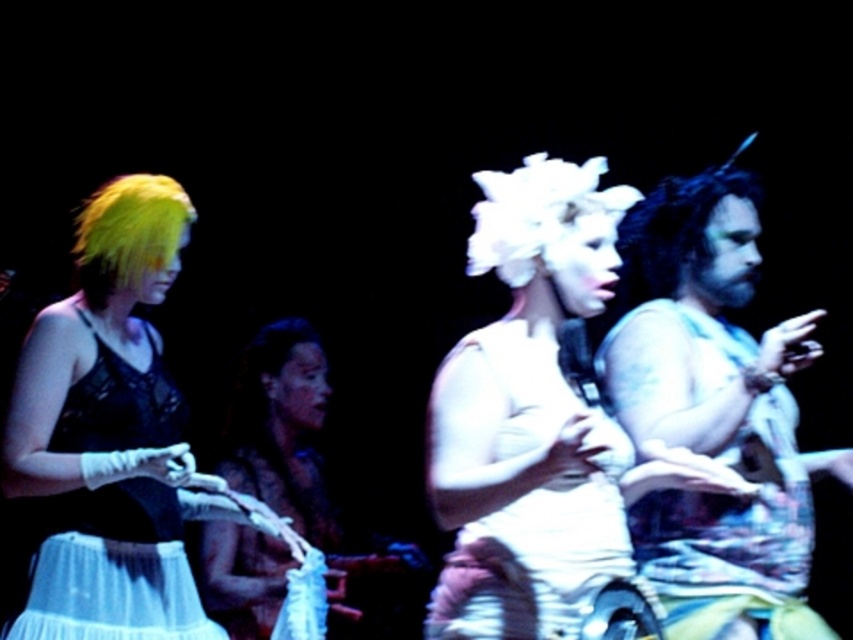
You are a stagehand positioned at the center of the stage. You need to quickly retrieve an item from the bearded man with tattoos at right. Based on their position, in which direction should you move to reach them?

The bearded man with tattoos at right is located at point 0.642 on the x and 0.838 on the y. Since you are at the center, you should move to the right and forward to reach them.

You are a photographer standing in the audience. You want to take a photo of both the bearded man with tattoos at right and the matte black dress at center. Which subject should you focus on first to ensure they are both in frame?

You should focus on the bearded man with tattoos at right first because he is wider than the matte black dress at center, so positioning him first ensures there is enough space for both in the frame.

You are a costume designer reviewing the image of the performance scene. You notice two central costumes labeled as the white cotton tank top at center and the matte black dress at center. Which costume has a larger size?

The matte black dress at center is larger than the white cotton tank top at center.